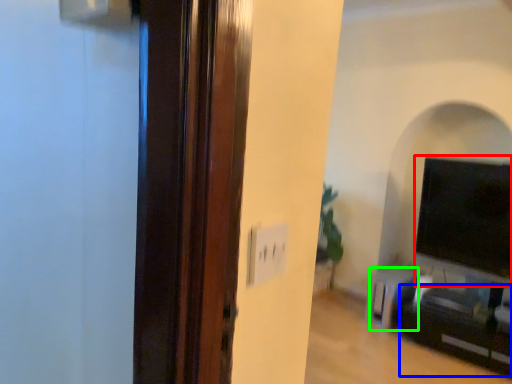
Question: Which object is positioned closest to wide (highlighted by a red box)? Select from entertainment center (highlighted by a blue box) and furniture (highlighted by a green box).

Choices:
 (A) entertainment center
 (B) furniture

Answer: (B)